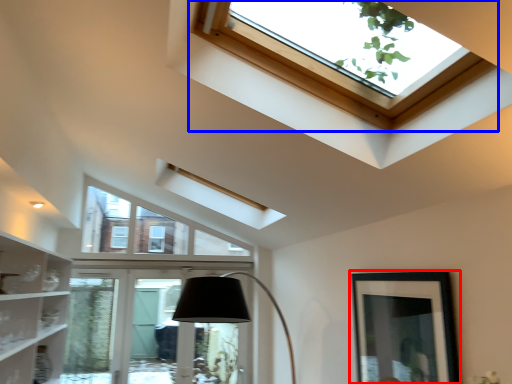
Question: Which of the following is the farthest to the observer, picture frame (highlighted by a red box) or window (highlighted by a blue box)?

Choices:
 (A) picture frame
 (B) window

Answer: (A)